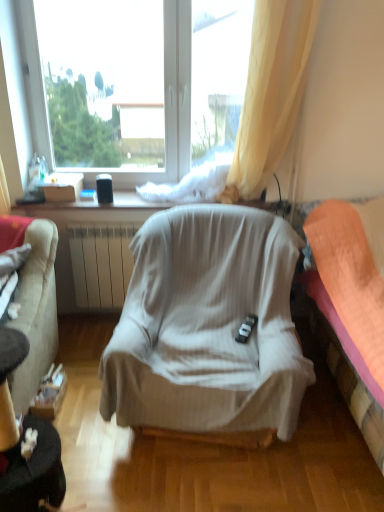
Question: In the image, is white matte window at upper center on the left side or the right side of orange fabric bed at right?

Choices:
 (A) left
 (B) right

Answer: (A)

Question: Relative to orange fabric bed at right, is white matte window at upper center in front or behind?

Choices:
 (A) front
 (B) behind

Answer: (B)

Question: Which is nearer to the light beige fabric chair at center?

Choices:
 (A) white cardboard box at upper left
 (B) white matte window at upper center
 (C) black plastic remote control at center
 (D) orange fabric bed at right
 (E) velvet beige couch at left

Answer: (C)

Question: Estimate the real-world distances between objects in this image. Which object is farther from the white matte window at upper center?

Choices:
 (A) black plastic remote control at center
 (B) orange fabric bed at right
 (C) white cardboard box at upper left
 (D) light beige fabric chair at center
 (E) velvet beige couch at left

Answer: (A)